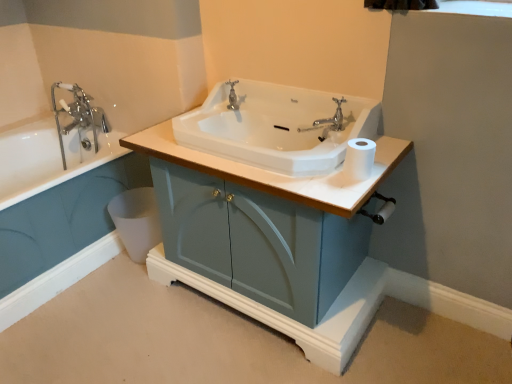
I want to click on vacant space situated on the left part of matte blue cabinet at center, so click(108, 323).